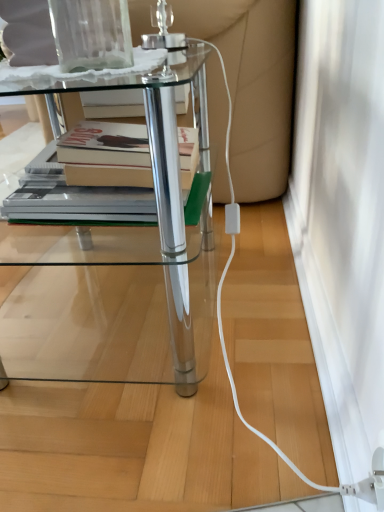
This screenshot has width=384, height=512. What are the coordinates of `free region under white matte screen door at lower right (from a real-world perspective)` in the screenshot? It's located at (311, 312).